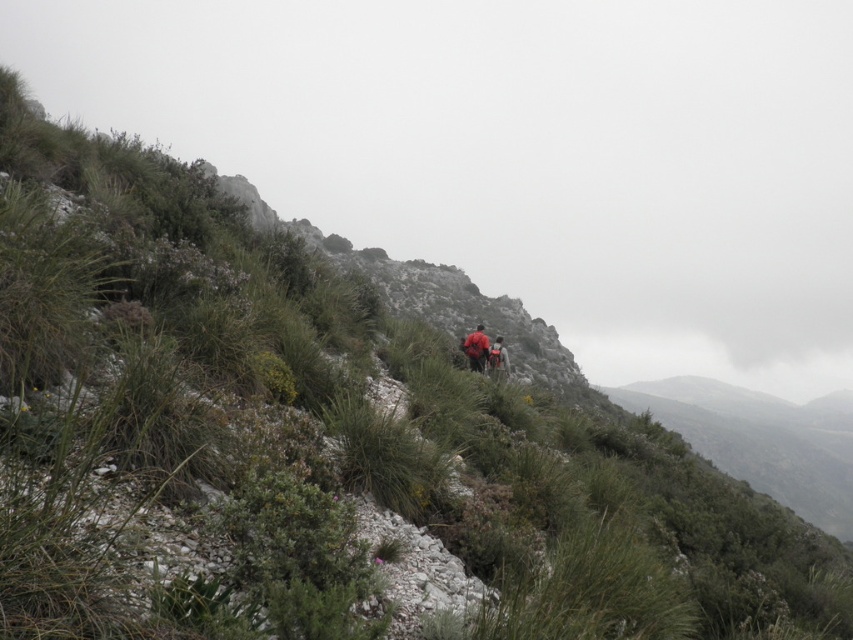
Can you confirm if red fabric backpack at center is positioned to the left of orange fabric backpack at center?

Yes, red fabric backpack at center is to the left of orange fabric backpack at center.

Consider the image. Is red fabric backpack at center further to camera compared to orange fabric backpack at center?

Yes, it is.

Who is more distant from viewer, [474,339] or [502,372]?

The point [474,339] is behind.

Where is `red fabric backpack at center`? red fabric backpack at center is located at coordinates (476, 348).